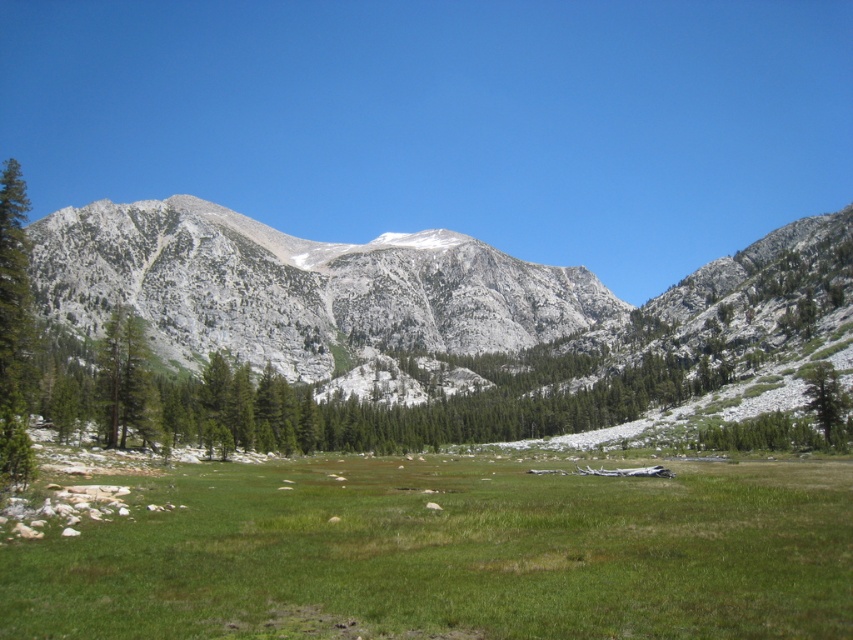
You are a hiker trying to decide whether to cross the green grassy field at center or go around the green textured tree at right. Which path would be shorter in distance?

The green grassy field at center is not as tall as the green textured tree at right, but the question is about distance, not height. Since the description only mentions height, we cannot determine which path is shorter based on the provided information.

You are a hiker standing at the edge of the green grassy field at center. You want to reach the green textured tree at right. Considering your average walking speed is 1.4 meters per second, how many minutes will it take you to walk directly to the tree?

The distance between the green grassy field at center and the green textured tree at right is 49.48 meters. At a walking speed of 1.4 meters per second, it would take approximately 35.34 seconds, which is roughly 0.59 minutes. Therefore, it will take about 0.59 minutes to reach the tree.

You are standing on the green grassy field at center and want to reach the white rocky mountain at center. Which direction should you move to get closer to the mountain?

You should move upward because the green grassy field at center is below the white rocky mountain at center, so moving upward would bring you closer to the mountain.